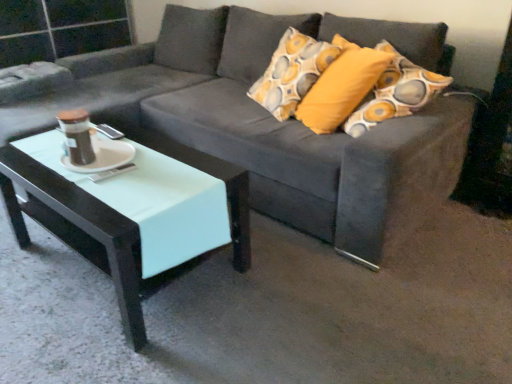
Locate an element on the screen. free space above white glossy saucer at center (from a real-world perspective) is located at coordinates (100, 151).